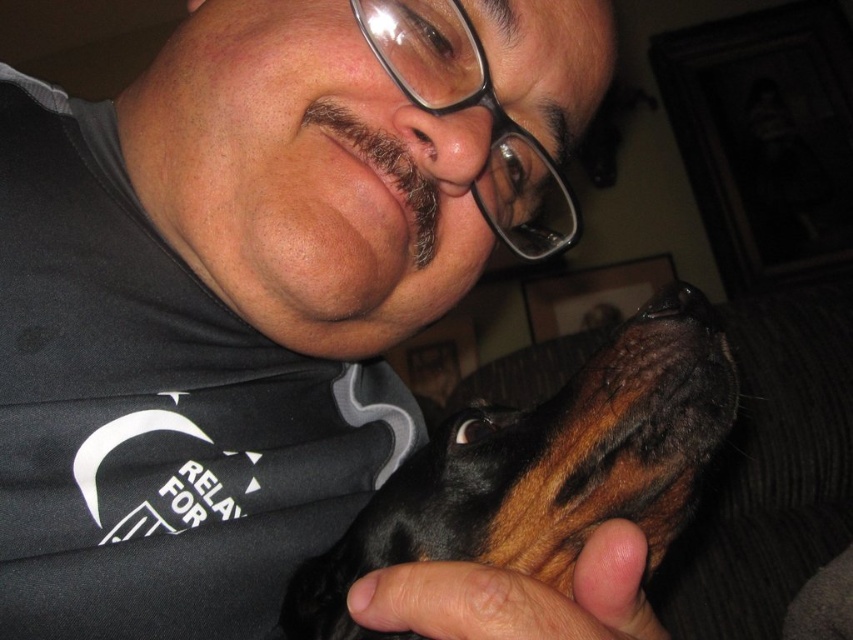
Question: Among these points, which one is farthest from the camera?

Choices:
 (A) (486, 476)
 (B) (212, 276)

Answer: (B)

Question: Which of the following is the farthest from the observer?

Choices:
 (A) black shiny dog at center
 (B) black matte shirt at center

Answer: (B)

Question: Does black matte shirt at center appear over black shiny dog at center?

Choices:
 (A) yes
 (B) no

Answer: (A)

Question: Is black matte shirt at center in front of black shiny dog at center?

Choices:
 (A) yes
 (B) no

Answer: (B)

Question: Is black matte shirt at center further to camera compared to black shiny dog at center?

Choices:
 (A) no
 (B) yes

Answer: (B)